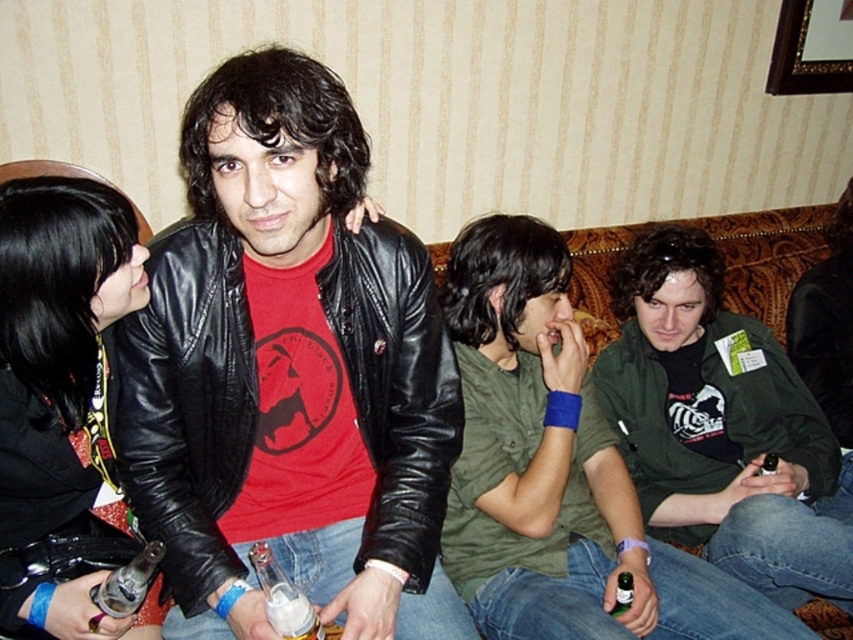
You are a photographer setting up for a group photo. You need to ensure that the matte black leather jacket at center and the white frothy beer at lower left are both visible in the frame. Based on their sizes, which object should you prioritize positioning closer to the camera to maintain clarity?

The matte black leather jacket at center is wider than the white frothy beer at lower left, so you should prioritize positioning the matte black leather jacket at center closer to the camera to maintain clarity.

You are standing in front of the sofa where the group is seated. There are two points marked in the image. The first point is at coordinates point (x=822, y=81) and the second is at point (x=630, y=600). If you were to walk towards the sofa, which point would you reach first?

Point (x=822, y=81) is further to the viewer than point (x=630, y=600), so you would reach point (x=822, y=81) first as it is closer to your current position.